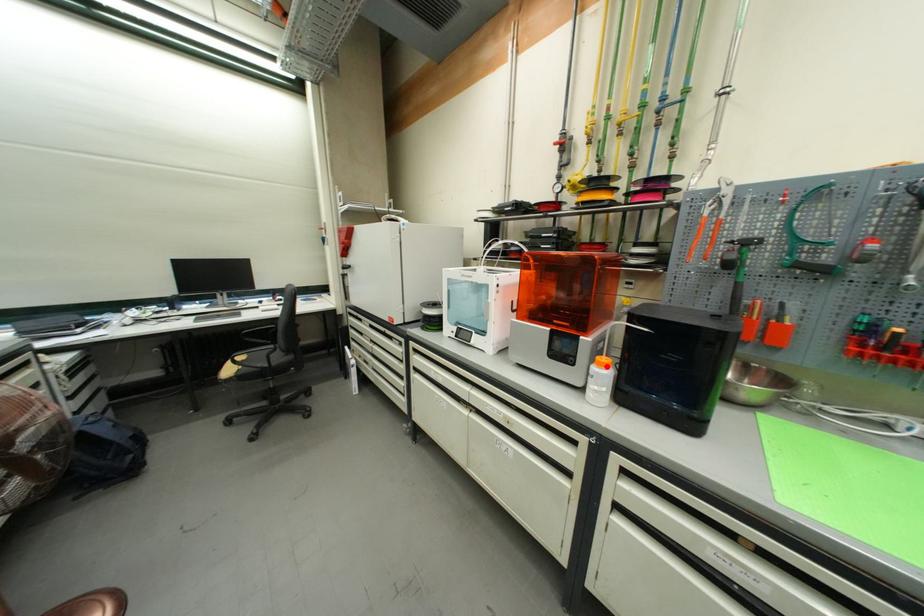
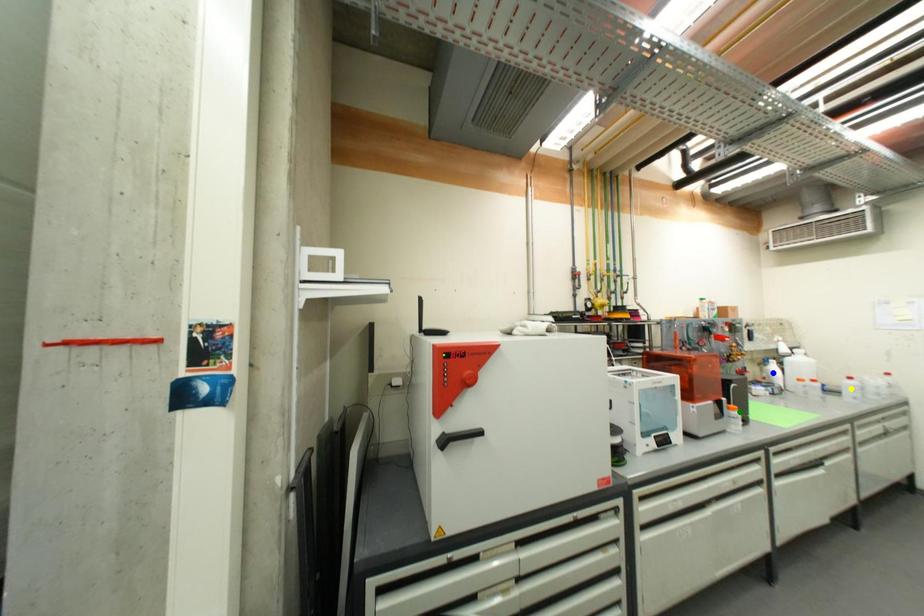
Question: I am providing you with two images of the same scene from different viewpoints. A red point is marked on the first image. You are given multiple points on the second image. Which spot in image 2 lines up with the point in image 1?

Choices:
 (A) yellow point
 (B) blue point
 (C) green point

Answer: (C)